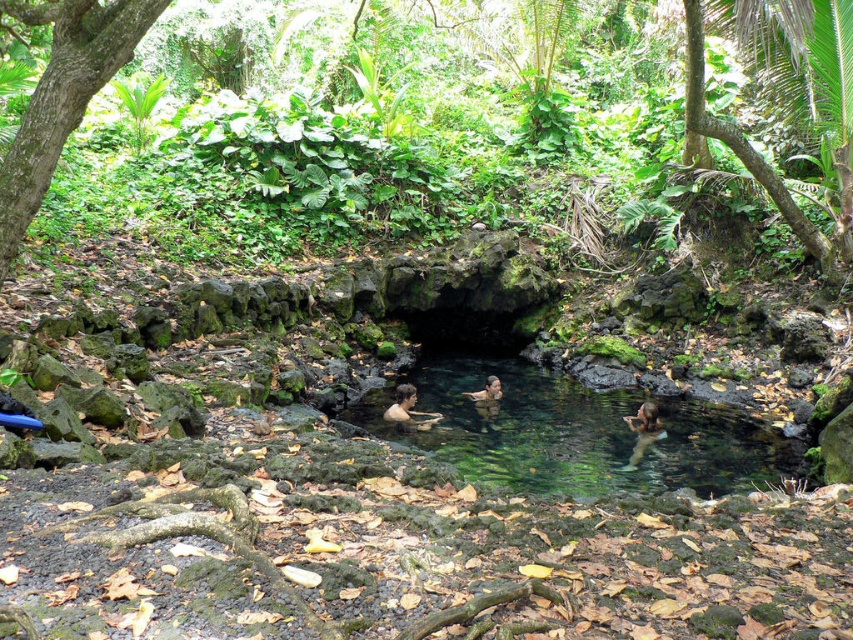
Question: Which of the following is the closest to the observer?

Choices:
 (A) clear water at center
 (B) nude skin at lower right
 (C) brown skin at center
 (D) green leafy vegetation at center

Answer: (D)

Question: Which point is closer to the camera taking this photo?

Choices:
 (A) (747, 435)
 (B) (473, 397)
 (C) (650, 428)
 (D) (573, 76)

Answer: (C)

Question: Can you confirm if clear water at center is positioned to the right of brown skin at center?

Choices:
 (A) no
 (B) yes

Answer: (B)

Question: Which object is farther from the camera taking this photo?

Choices:
 (A) green leafy vegetation at center
 (B) clear water at center
 (C) nude skin at lower right

Answer: (C)

Question: Is clear water at center wider than nude skin at lower right?

Choices:
 (A) no
 (B) yes

Answer: (B)

Question: Can you confirm if clear water at center is positioned above brown skin at center?

Choices:
 (A) no
 (B) yes

Answer: (A)